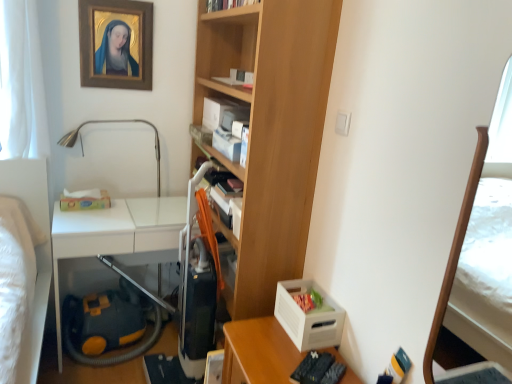
I want to click on free space above wooden desk at lower right (from a real-world perspective), so click(289, 359).